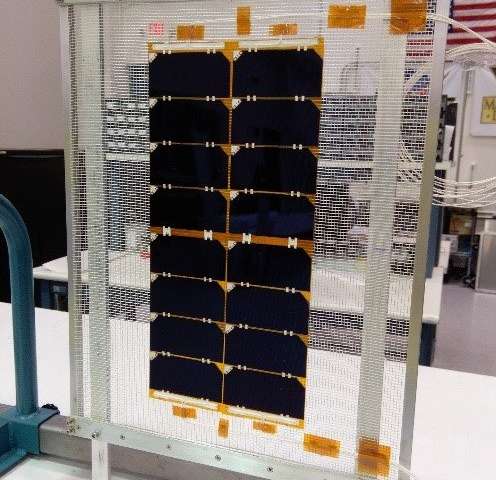
This screenshot has width=496, height=480. In order to click on wall in this screenshot , I will do `click(27, 83)`.